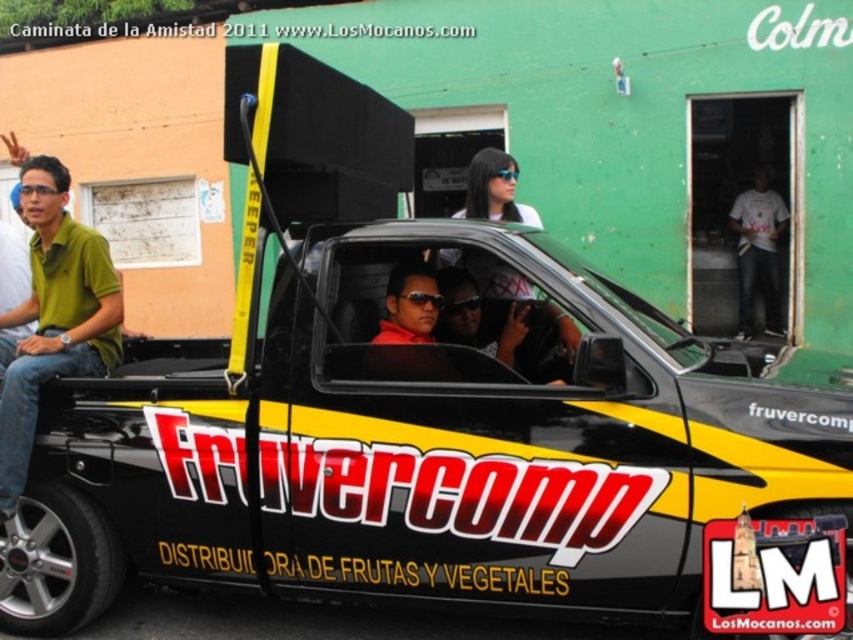
Question: Is green matte shirt at left to the right of white t-shirt at center from the viewer's perspective?

Choices:
 (A) yes
 (B) no

Answer: (B)

Question: Does green matte shirt at left appear under white t-shirt at center?

Choices:
 (A) yes
 (B) no

Answer: (A)

Question: Does green matte shirt at left appear on the left side of white t-shirt at center?

Choices:
 (A) no
 (B) yes

Answer: (B)